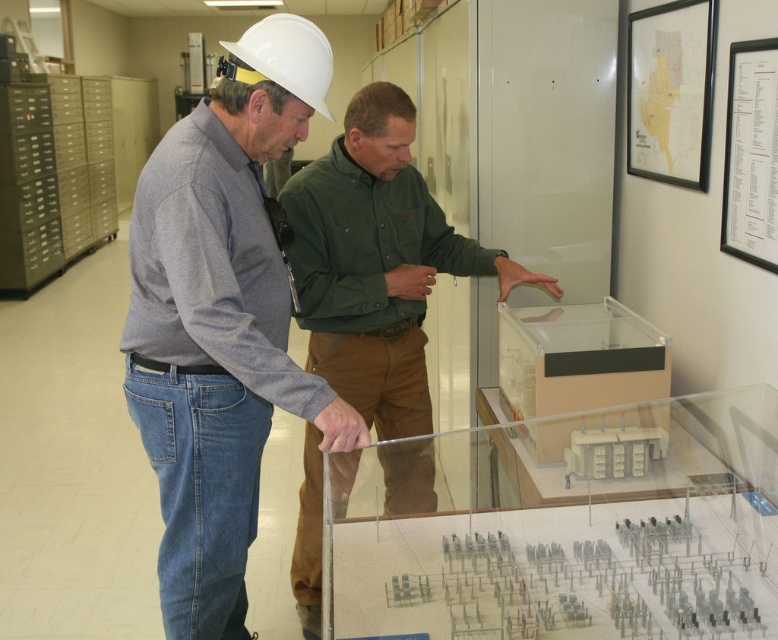
You are standing in front of the glass enclosure containing the electrical substation model. You notice two points labeled on the model. Which point is closer to you, point (293, 29) or point (247, 56)?

Point (293, 29) is further to the viewer than point (247, 56), so the closer point to you is point (247, 56).

From the picture: You are standing in front of the glass enclosure containing the electrical substation model. There is a specific point at coordinates point (323, 204) that you need to reach with your finger. Considering your arm can extend 1.8 meters, can you touch that point without moving your feet?

The distance between you and point (323, 204) is 2.19 meters. Since your arm can only extend 1.8 meters, you cannot reach the point without moving your feet.

You are an observer in the office. You need to locate the green matte shirt at center and the white hard hat at upper center. Which object is positioned more to the left?

The white hard hat at upper center is positioned more to the left than the green matte shirt at center.